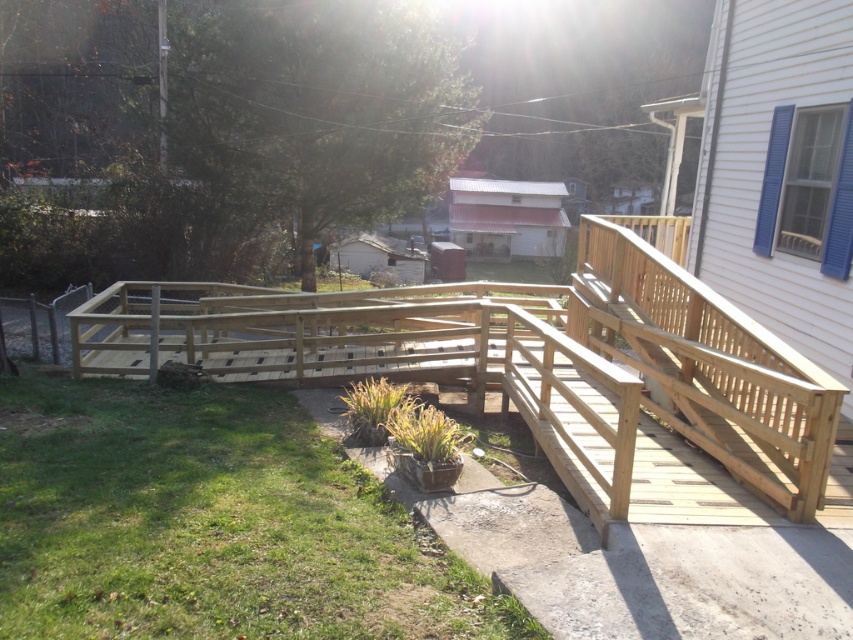
Question: Can you confirm if natural wood porch at center is wider than natural wood handrail at upper right?

Choices:
 (A) no
 (B) yes

Answer: (B)

Question: Does natural wood porch at center have a larger size compared to natural wood handrail at upper right?

Choices:
 (A) no
 (B) yes

Answer: (B)

Question: Which object appears closest to the camera in this image?

Choices:
 (A) natural wood porch at center
 (B) natural wood handrail at upper right

Answer: (B)

Question: Observing the image, what is the correct spatial positioning of natural wood porch at center in reference to natural wood handrail at upper right?

Choices:
 (A) above
 (B) below

Answer: (A)

Question: Among these points, which one is farthest from the camera?

Choices:
 (A) (357, 340)
 (B) (782, 464)

Answer: (A)